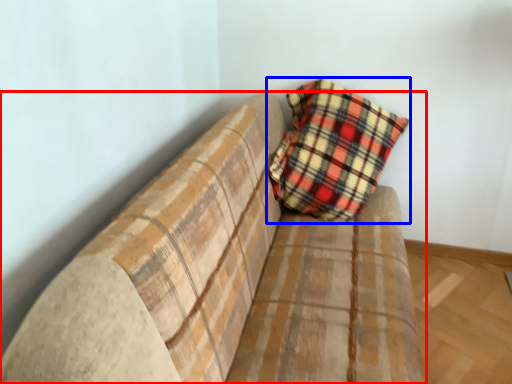
Question: Which point is closer to the camera, studio couch (highlighted by a red box) or pillow (highlighted by a blue box)?

Choices:
 (A) studio couch
 (B) pillow

Answer: (A)